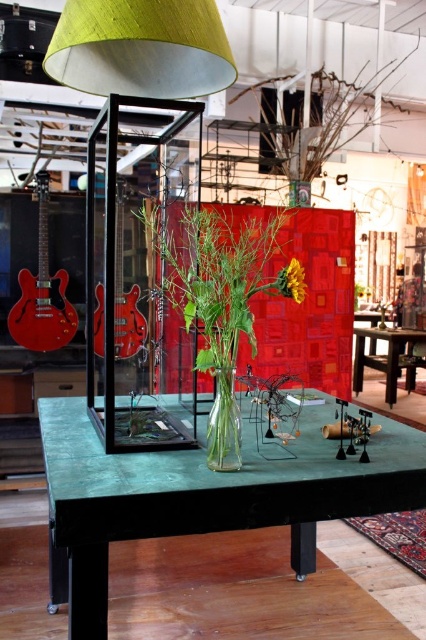
You are an interior designer arranging items on the table. You have two glass vases, the clear glass vase at center and the transparent glass vase at center. According to the scene, which one is placed higher?

The clear glass vase at center is located above the transparent glass vase at center, so the clear glass vase at center is placed higher.

You are a delivery person who needs to place a small package between the clear glass vase at center and the transparent glass display case on the left. The package requires 1 meter of space to be placed safely. Is there enough space between them?

The clear glass vase at center and the transparent glass display case on the left are 1.24 meters apart, so yes, there is enough space to place the package safely between them since 1.24 meters is greater than 1 meter required.